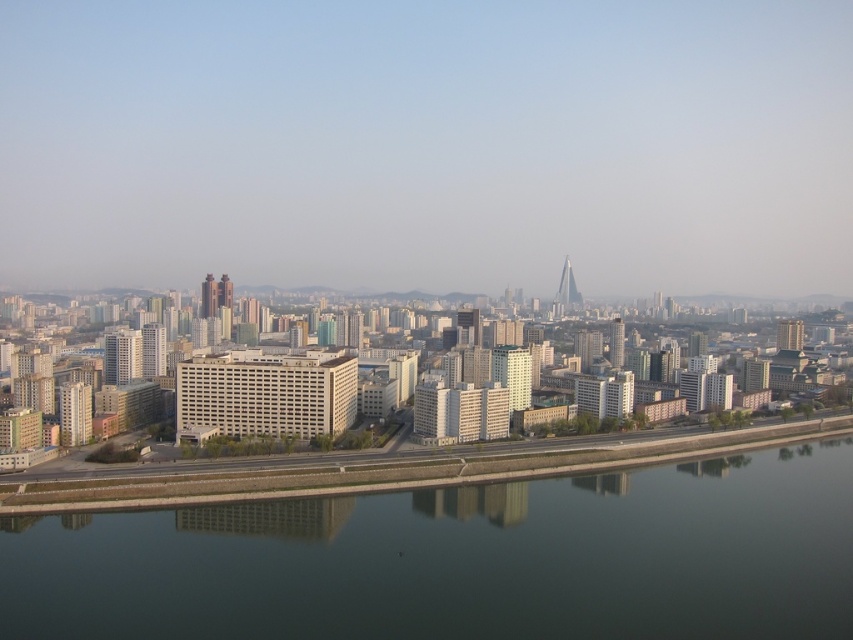
Question: Which point appears farthest from the camera in this image?

Choices:
 (A) (712, 516)
 (B) (572, 301)
 (C) (779, 336)

Answer: (B)

Question: Does green reflective water at center have a larger size compared to smooth glass skyscraper at center right?

Choices:
 (A) yes
 (B) no

Answer: (A)

Question: Is white glossy building at left above matte gray skyscraper at center-left?

Choices:
 (A) no
 (B) yes

Answer: (A)

Question: Which point is closer to the camera?

Choices:
 (A) matte gray skyscraper at center-left
 (B) white glass tower at center-right
 (C) green reflective water at center

Answer: (C)

Question: Which object is closer to the camera taking this photo?

Choices:
 (A) matte gray skyscraper at center-left
 (B) white glossy building at left

Answer: (B)

Question: Where is white glossy building at left located in relation to matte white building at right in the image?

Choices:
 (A) below
 (B) above

Answer: (A)